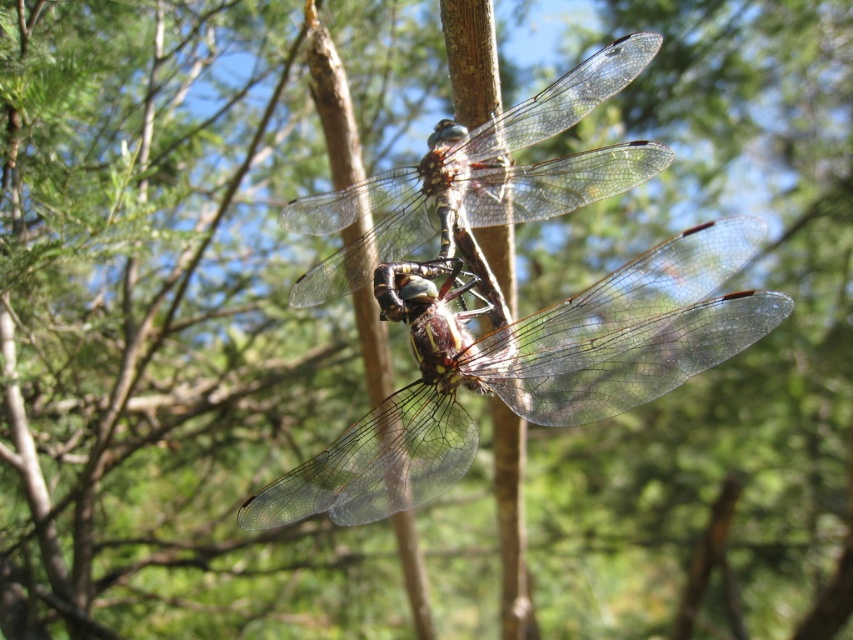
From the picture: You are an artist creating a sculpture of two dragonflies. You have two glass dragonflies, the translucent glass dragonfly at center and the transparent glass dragonfly at center. You need to place them exactly 30 centimeters apart on a branch. Based on the image, will you need to move them closer together or farther apart to achieve the desired distance?

The translucent glass dragonfly at center and transparent glass dragonfly at center are currently 32.62 centimeters apart. To reach the desired 30 centimeter distance, you need to move them closer together by approximately 2.62 centimeters.

You are an entomologist examining the dragonflies in the image. You have a magnifying glass and want to focus on the translucent glass dragonfly at center. Where exactly should you point your magnifying glass to locate it?

You should point your magnifying glass to the coordinates at point (526,368) to locate the translucent glass dragonfly at center.